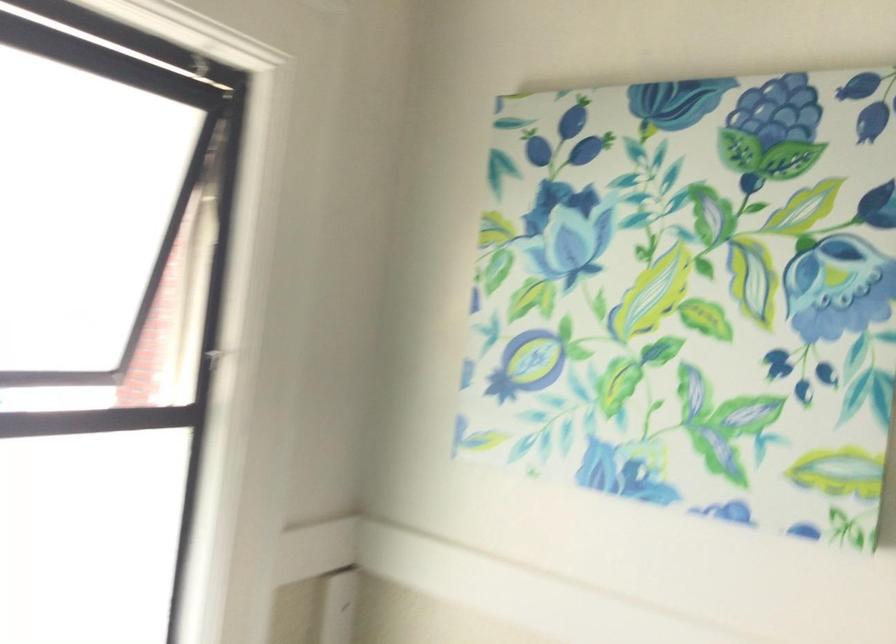
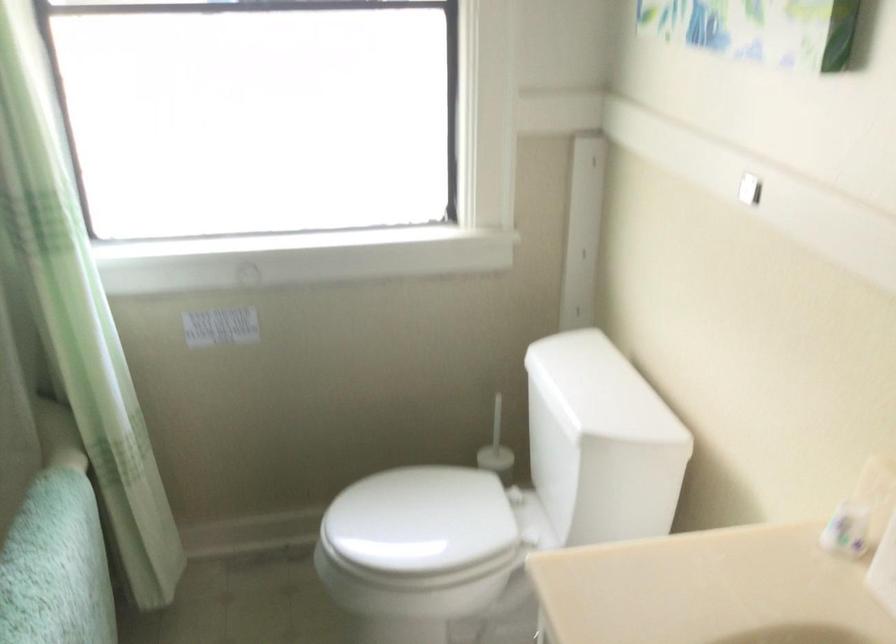
The images are taken continuously from a first-person perspective. In which direction is your viewpoint rotating?

The rotation direction of the camera is left-down.